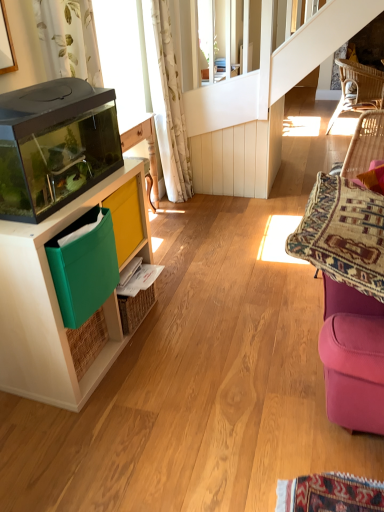
I want to click on vacant space to the right of white floral fabric curtain at upper left, so click(213, 197).